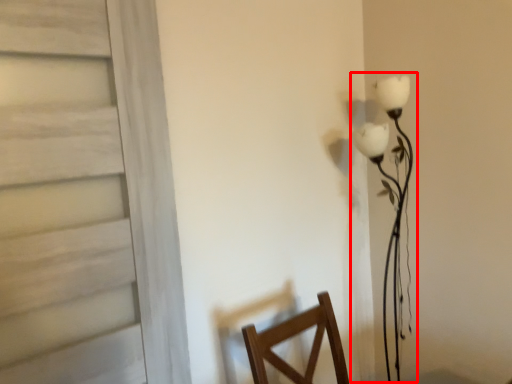
Question: From the image's perspective, what is the correct spatial relationship of table lamp (annotated by the red box) in relation to door?

Choices:
 (A) below
 (B) above

Answer: (A)